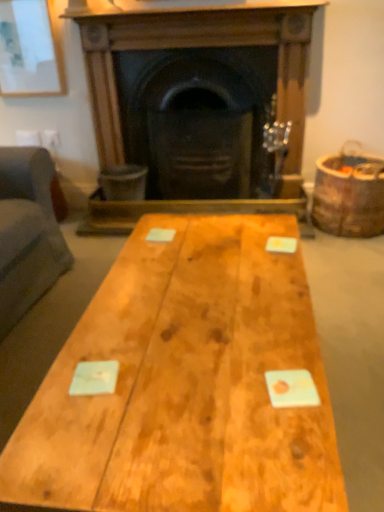
Question: Does point (155, 280) appear closer or farther from the camera than point (357, 202)?

Choices:
 (A) farther
 (B) closer

Answer: (B)

Question: Do you think natural wood table at center is within brown wooden barrel at right, or outside of it?

Choices:
 (A) outside
 (B) inside

Answer: (A)

Question: Estimate the real-world distances between objects in this image. Which object is farther from the natural wood table at center?

Choices:
 (A) matte white picture frame at upper left
 (B) brown wooden barrel at right
 (C) wooden fireplace at center

Answer: (A)

Question: Which is farther from the matte white picture frame at upper left?

Choices:
 (A) wooden fireplace at center
 (B) natural wood table at center
 (C) brown wooden barrel at right

Answer: (B)